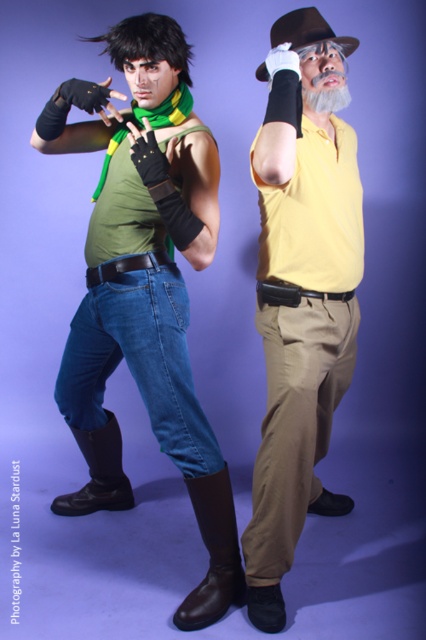
Is point (215, 477) positioned before point (301, 150)?

That is False.

Who is more distant from viewer, (150,96) or (351,499)?

The point (351,499) is behind.

Where is `matte green tank top at left`? Image resolution: width=426 pixels, height=640 pixels. matte green tank top at left is located at coordinates (146, 289).